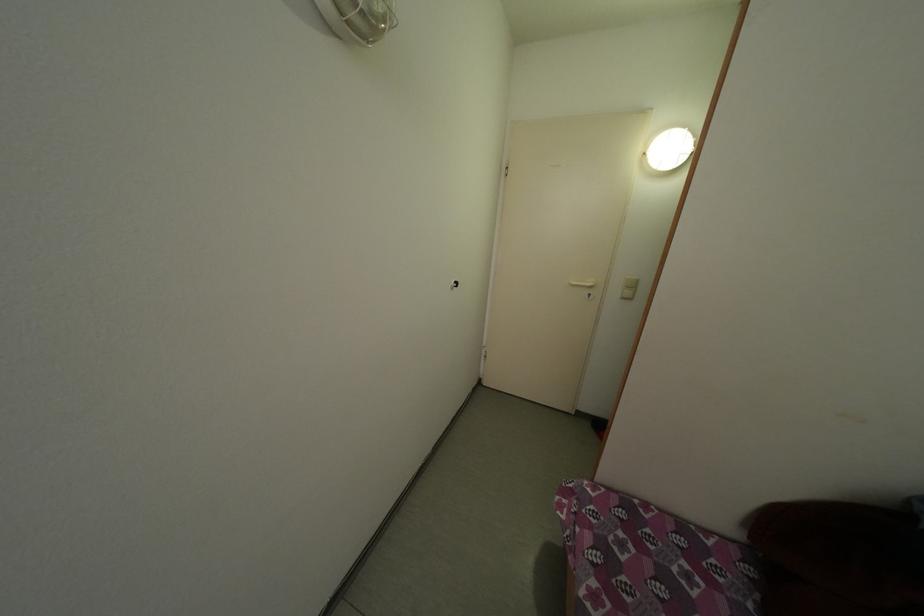
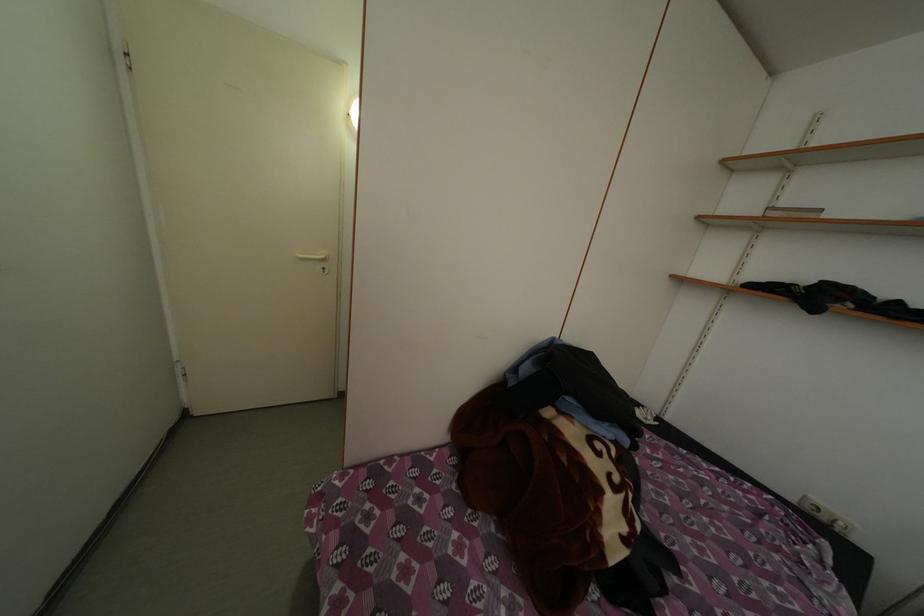
Question: The camera is either moving clockwise (left) or counter-clockwise (right) around the object. The first image is from the beginning of the video and the second image is from the end. Is the camera moving left or right when shooting the video?

Choices:
 (A) Left
 (B) Right

Answer: (A)